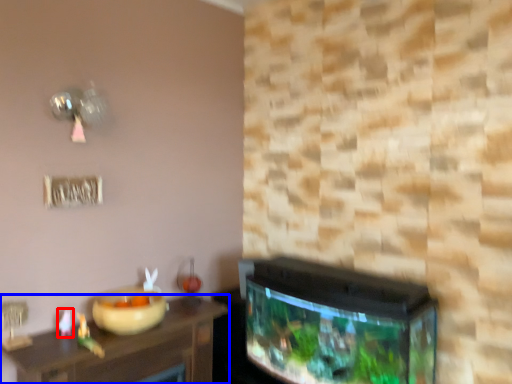
Question: Which object appears farthest to the camera in this image, toy (highlighted by a red box) or table (highlighted by a blue box)?

Choices:
 (A) toy
 (B) table

Answer: (A)